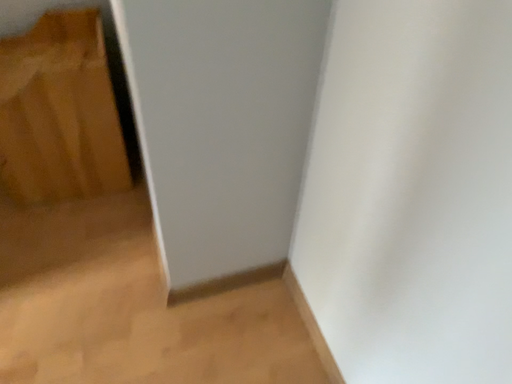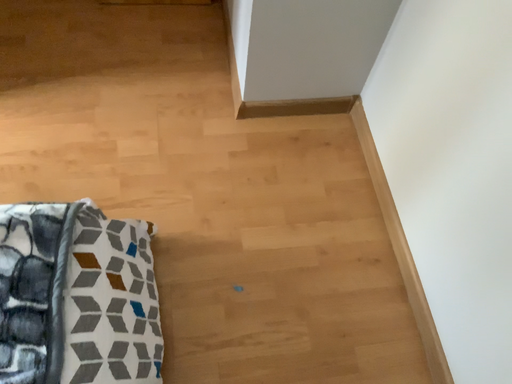
Question: How did the camera likely rotate when shooting the video?

Choices:
 (A) rotated downward
 (B) rotated upward

Answer: (A)